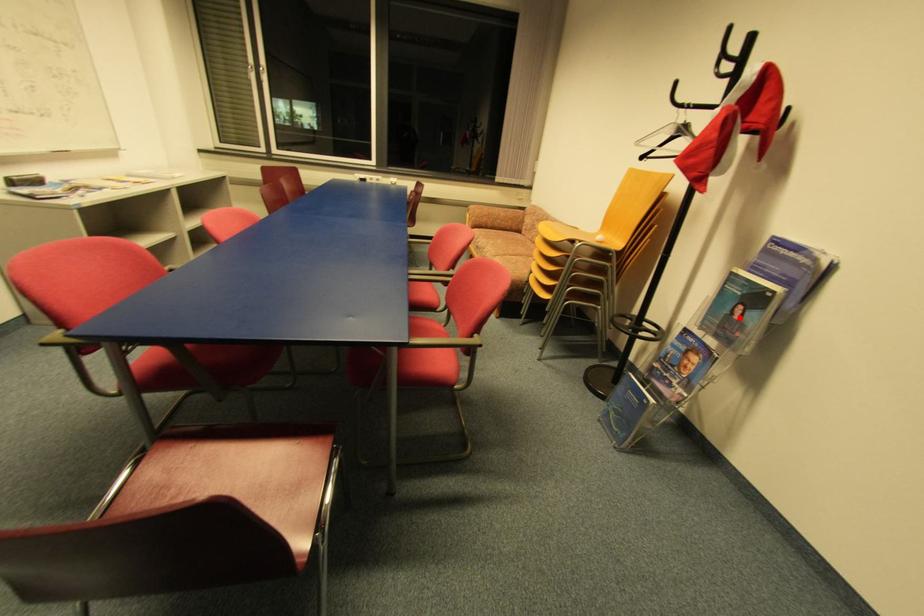
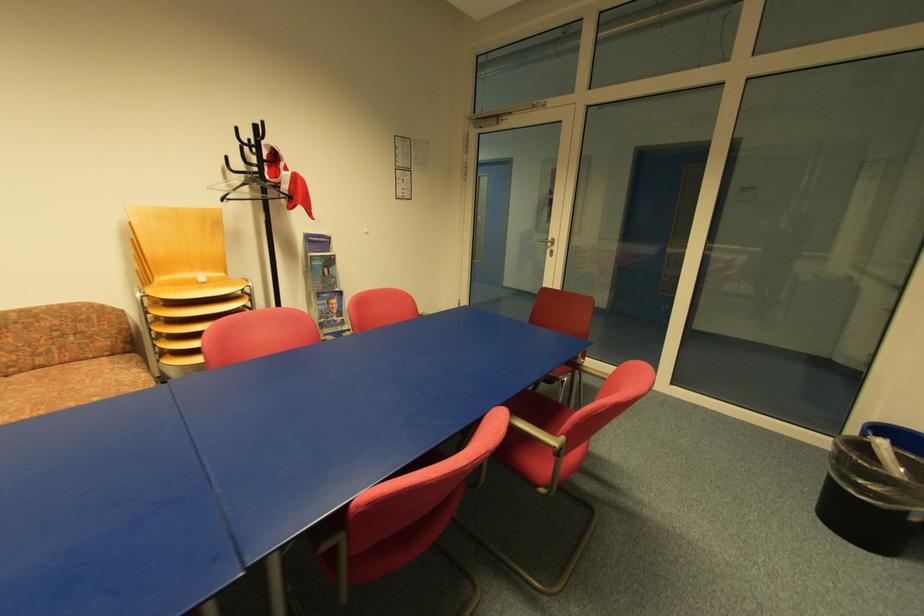
Locate, in the second image, the point that corresponds to the highlighted location in the first image.

(331, 275)